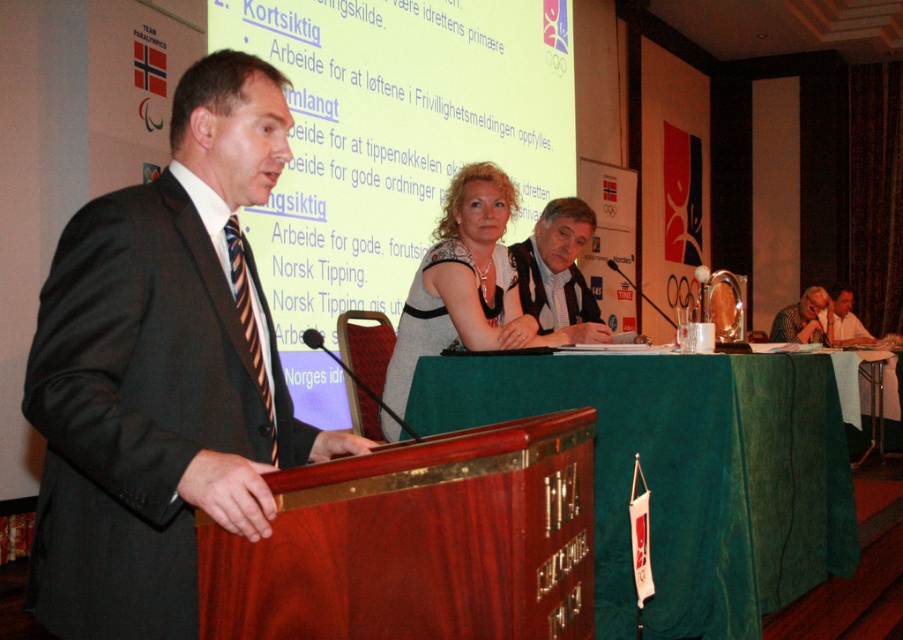
You are standing at the front of the conference room and want to place a new projector at a specific point to ensure it is exactly 9 feet away from the camera. Is the point at coordinates point [677,467] suitable for this purpose?

The distance of point [677,467] from camera is 8.99 feet, which is very close to 9 feet. Therefore, the point at coordinates point [677,467] is suitable for placing the projector as it meets the required distance.

You are an event planner who needs to ensure that the speaker is visible to the audience. Considering the gray textured blouse at center and the striped fabric tie at left, which one is closer to the front of the stage? Please base your answer on their positions relative to each other.

The gray textured blouse at center is closer to the front of the stage than the striped fabric tie at left because the distance between them is 4.79 feet, indicating the blouse is positioned forward.